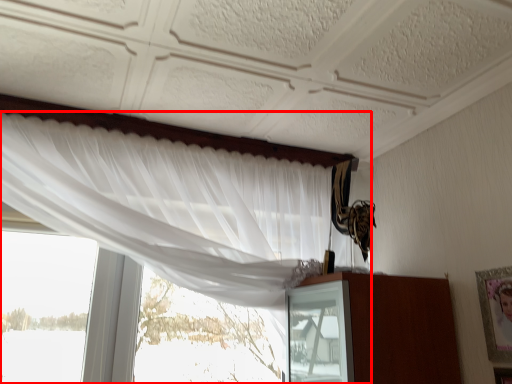
Question: From the image's perspective, what is the correct spatial positioning of curtain (annotated by the red box) in reference to picture frame?

Choices:
 (A) below
 (B) above

Answer: (B)